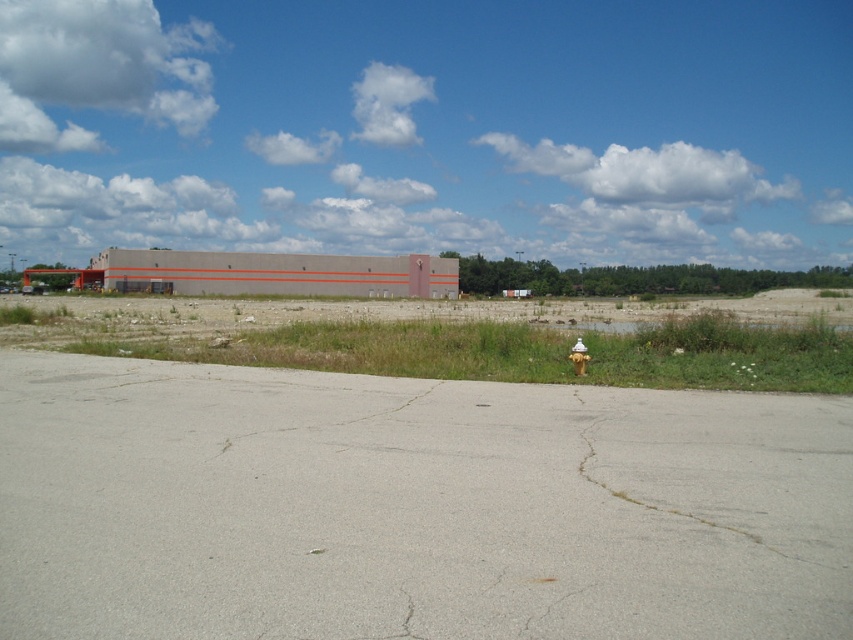
Question: Which of the following is the farthest from the observer?

Choices:
 (A) yellow metallic hydrant at center
 (B) gray cracked asphalt at center

Answer: (A)

Question: Is gray cracked asphalt at center above yellow metallic hydrant at center?

Choices:
 (A) no
 (B) yes

Answer: (A)

Question: Which point is farther from the camera taking this photo?

Choices:
 (A) (390, 406)
 (B) (585, 356)

Answer: (B)

Question: Does gray cracked asphalt at center lie in front of yellow metallic hydrant at center?

Choices:
 (A) yes
 (B) no

Answer: (A)

Question: Is gray cracked asphalt at center positioned in front of yellow metallic hydrant at center?

Choices:
 (A) no
 (B) yes

Answer: (B)